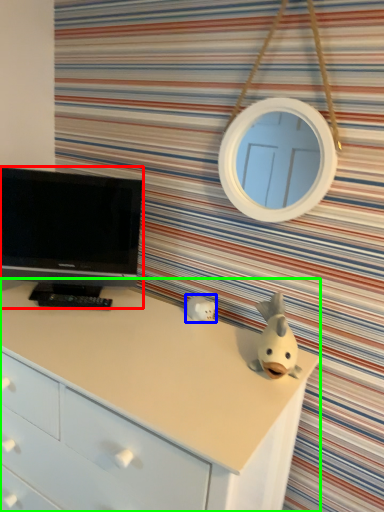
Question: Which object is positioned closest to television (highlighted by a red box)? Select from toy (highlighted by a blue box) and chest of drawers (highlighted by a green box).

Choices:
 (A) toy
 (B) chest of drawers

Answer: (B)